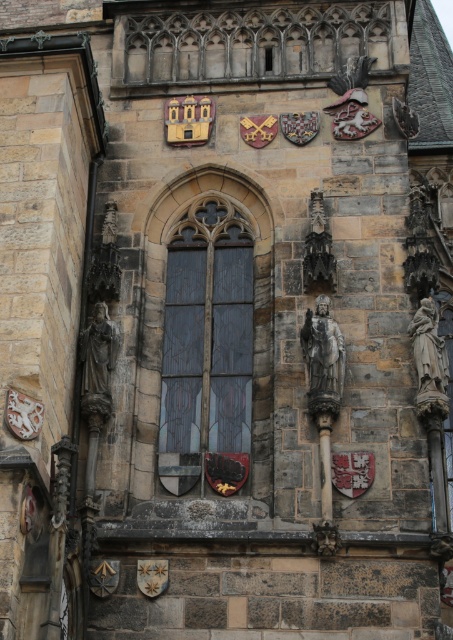
How much distance is there between stained glass window at center and stone statue at right?

stained glass window at center and stone statue at right are 8.00 meters apart.

Between point (207, 314) and point (428, 321), which one is positioned behind?

Positioned behind is point (207, 314).

Find the location of `stained glass window at center`. stained glass window at center is located at coordinates (207, 352).

You are a GUI agent. You are given a task and a screenshot of the screen. Output one action in this format:
    pyautogui.click(x=<x>, y=<y>)
    Task: Click on the polished stone statue at center
    This screenshot has height=640, width=453.
    Given the screenshot: What is the action you would take?
    pyautogui.click(x=322, y=349)

Consider the image. Can you confirm if stained glass window at center is positioned to the left of polished stone statue at center?

Yes, stained glass window at center is to the left of polished stone statue at center.

Does stained glass window at center appear over polished stone statue at center?

Indeed, stained glass window at center is positioned over polished stone statue at center.

Find the location of a particular element. stained glass window at center is located at coordinates click(x=207, y=352).

Locate an element on the screen. This screenshot has height=640, width=453. stained glass window at center is located at coordinates (207, 352).